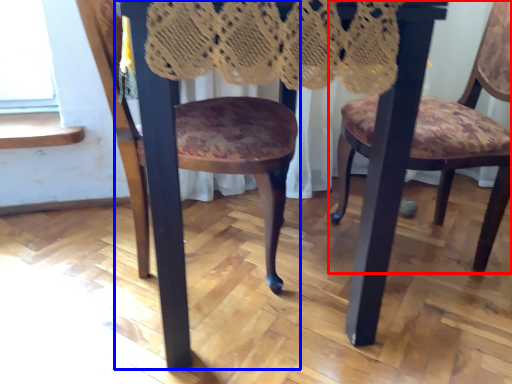
Question: Among these objects, which one is farthest to the camera, chair (highlighted by a red box) or chair (highlighted by a blue box)?

Choices:
 (A) chair
 (B) chair

Answer: (A)